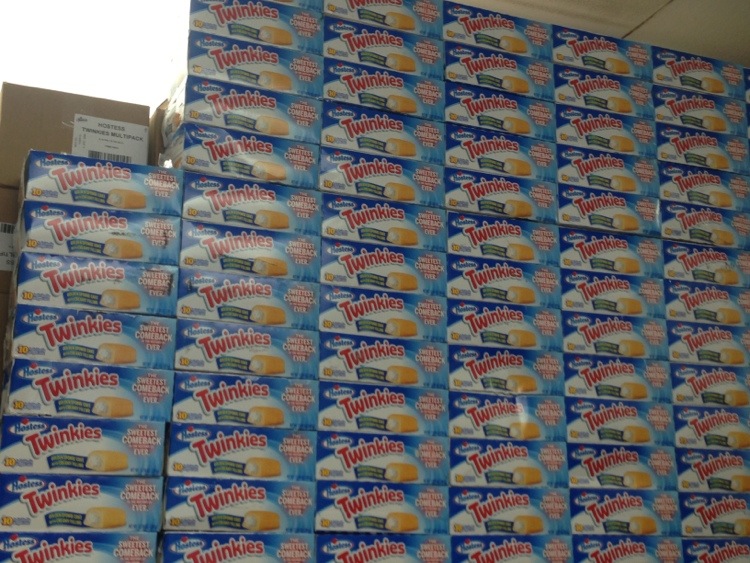
Find the location of a particular element. The height and width of the screenshot is (563, 750). cardboard box is located at coordinates (30, 132).